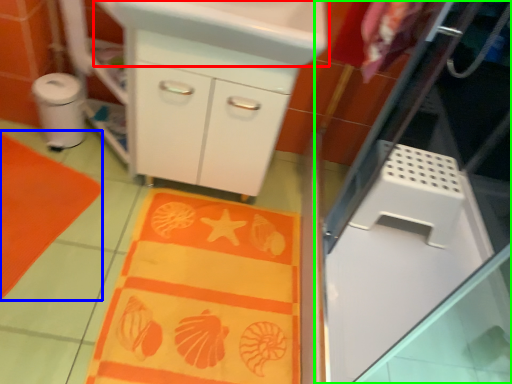
Question: Which object is positioned farthest from sink (highlighted by a red box)? Select from beach towel (highlighted by a blue box) and screen door (highlighted by a green box).

Choices:
 (A) beach towel
 (B) screen door

Answer: (A)